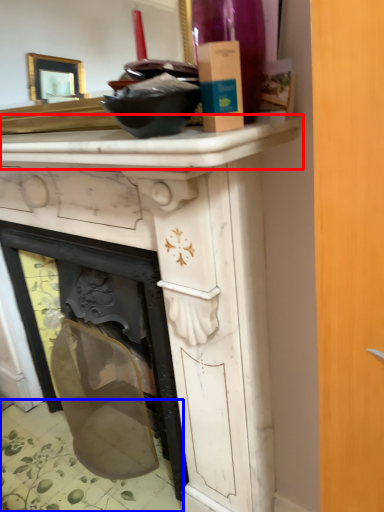
Question: Which of the following is the closest to the observer, counter top (highlighted by a red box) or tile (highlighted by a blue box)?

Choices:
 (A) counter top
 (B) tile

Answer: (A)